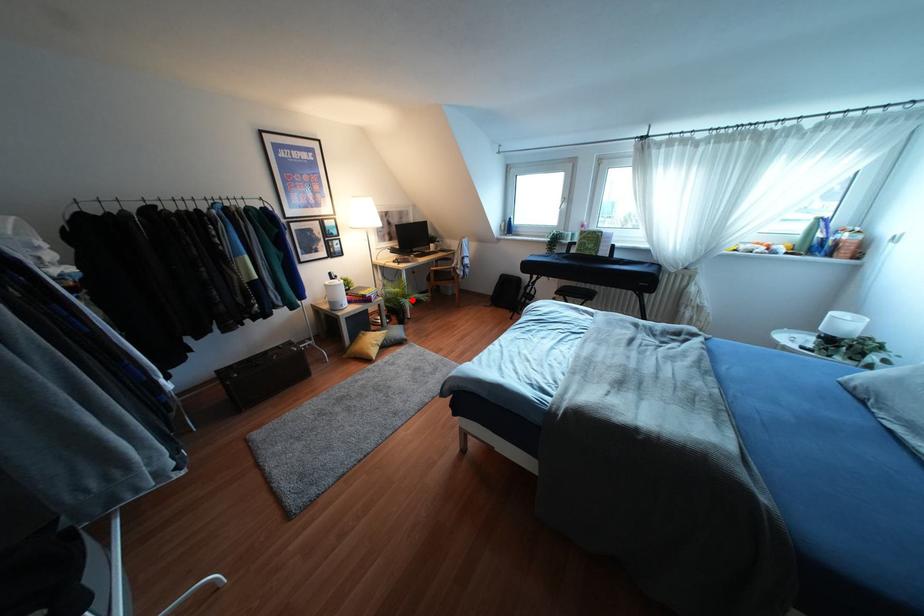
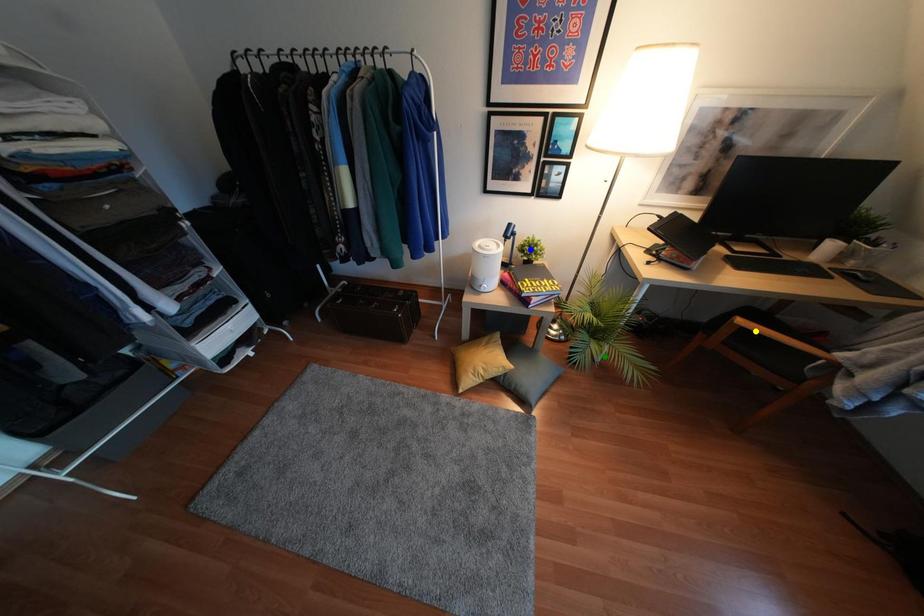
Question: I am providing you with two images of the same scene from different viewpoints. A red point is marked on the first image. You are given multiple points on the second image. Which spot in image 2 lines up with the point in image 1?

Choices:
 (A) blue point
 (B) yellow point
 (C) green point

Answer: (C)